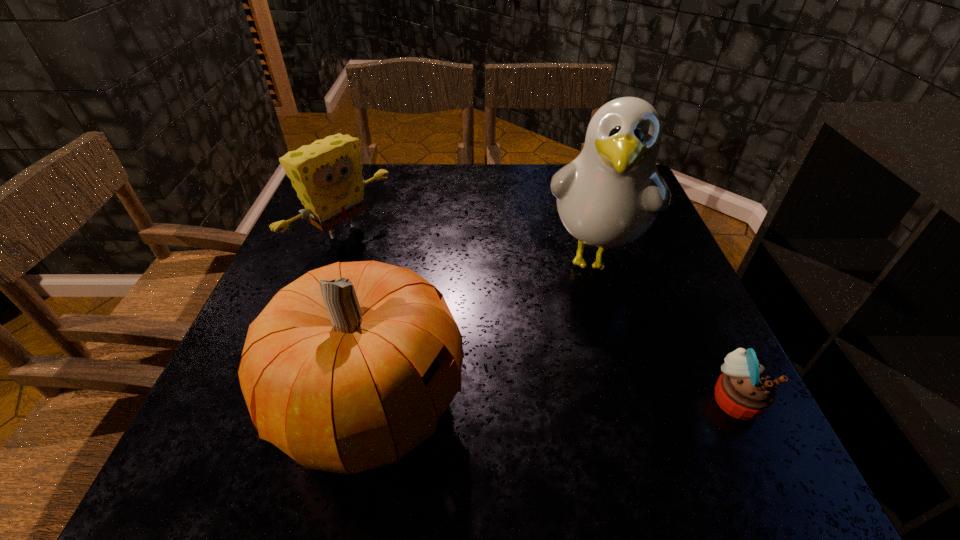
The height and width of the screenshot is (540, 960). I want to click on vacant area that lies between the gull and the rightmost object, so click(664, 328).

The height and width of the screenshot is (540, 960). What are the coordinates of `blank region between the muffin and the second shortest object` in the screenshot? It's located at (540, 318).

I want to click on unoccupied position between the sponge and the gull, so click(x=468, y=248).

Find the location of a particular element. Image resolution: width=960 pixels, height=540 pixels. vacant space that is in between the second tallest object and the gull is located at coordinates (482, 332).

Locate an element on the screen. free spot between the muffin and the third object from left to right is located at coordinates (664, 328).

Identify the location of the third closest object to the rightmost object. tap(327, 175).

Identify which object is the third closest to the muffin. Please provide its 2D coordinates. Your answer should be formatted as a tuple, i.e. [(x, y)], where the tuple contains the x and y coordinates of a point satisfying the conditions above.

[(327, 175)]